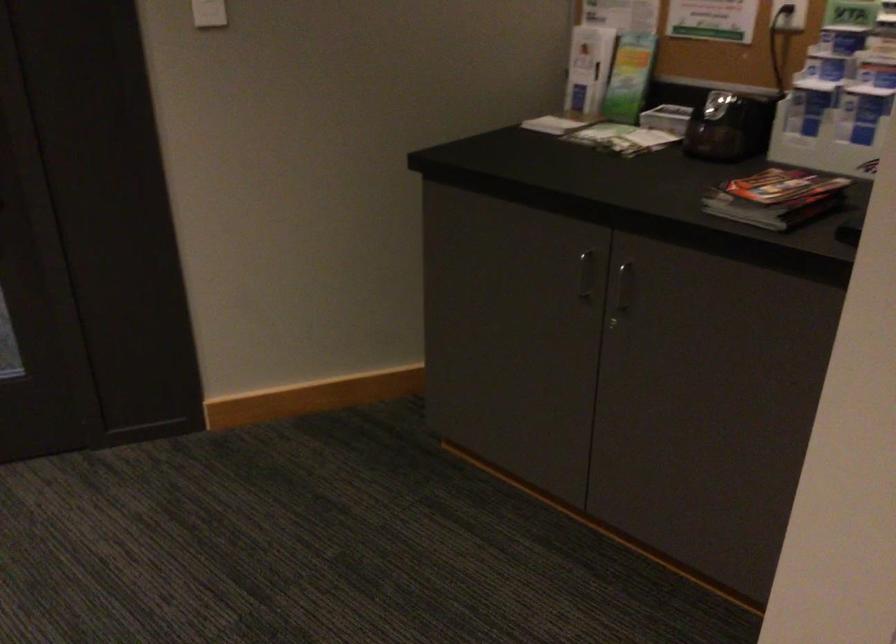
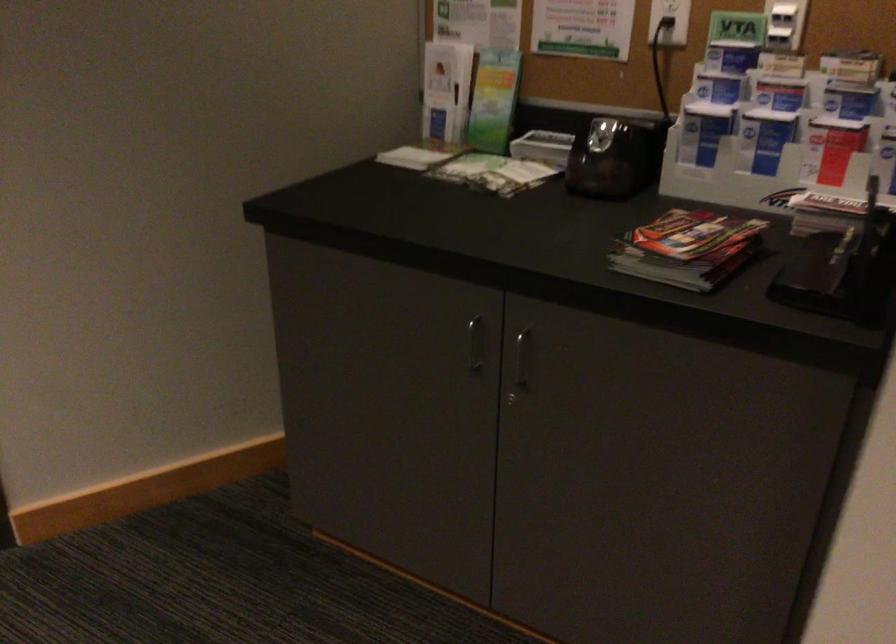
In the second image, find the point that corresponds to pixel 584 275 in the first image.

(475, 343)